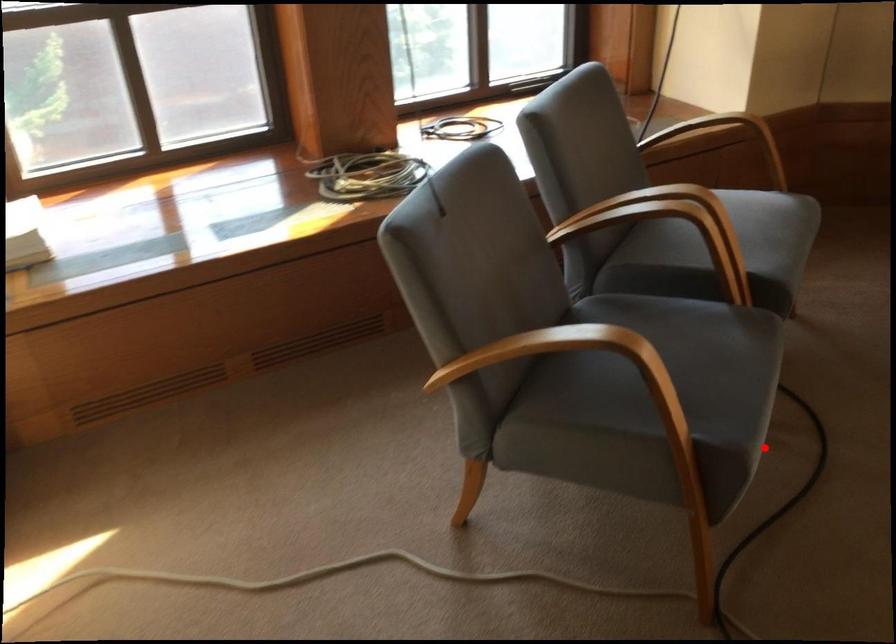
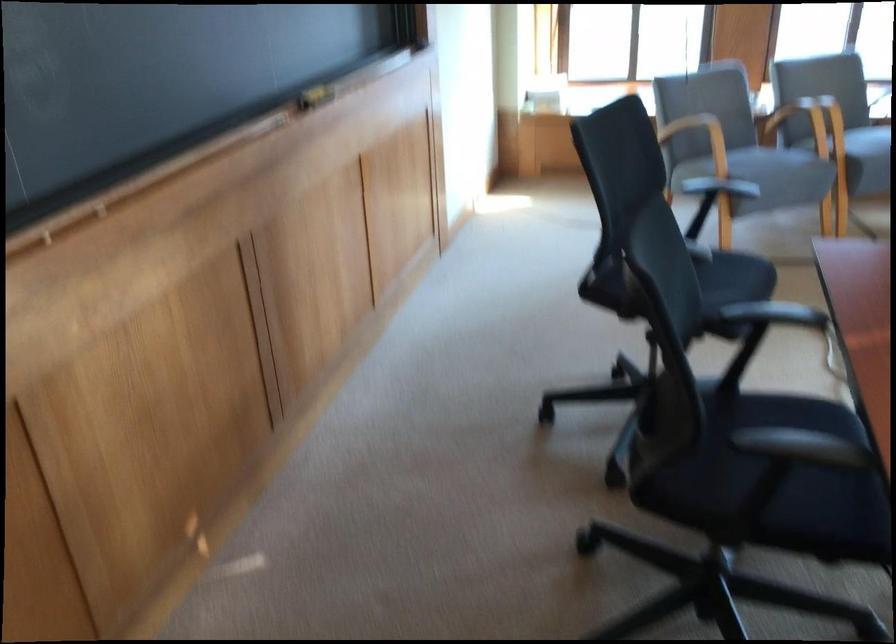
Question: A red point is marked in image1. In image2, is the corresponding 3D point closer to the camera or farther? Reply with the corresponding letter.

Choices:
 (A) The corresponding 3D point is closer.
 (B) The corresponding 3D point is farther.

Answer: (B)